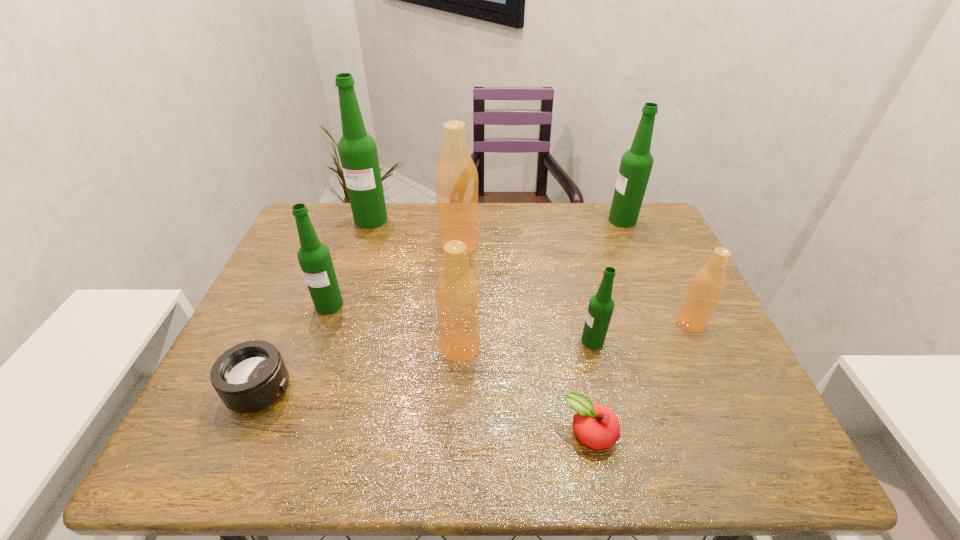
Locate an element on the screen. Image resolution: width=960 pixels, height=540 pixels. the biggest green beer bottle is located at coordinates coord(357,150).

Locate an element on the screen. The image size is (960, 540). the tallest object is located at coordinates (357, 150).

This screenshot has height=540, width=960. What are the coordinates of `the rightmost green beer bottle` in the screenshot? It's located at (636, 164).

Where is `the farthest tan beer bottle`? Image resolution: width=960 pixels, height=540 pixels. the farthest tan beer bottle is located at coordinates (456, 178).

At what (x,y) coordinates should I click in order to perform the action: click on the third farthest object. Please return your answer as a coordinate pair (x, y). The height and width of the screenshot is (540, 960). Looking at the image, I should click on (456, 178).

Locate an element on the screen. This screenshot has height=540, width=960. the second smallest green beer bottle is located at coordinates (314, 257).

At what (x,y) coordinates should I click in order to perform the action: click on the second biggest tan beer bottle. Please return your answer as a coordinate pair (x, y). Looking at the image, I should click on (457, 293).

The width and height of the screenshot is (960, 540). Identify the location of the second green beer bottle from right to left. (600, 309).

The height and width of the screenshot is (540, 960). Identify the location of the smallest green beer bottle. (600, 309).

The height and width of the screenshot is (540, 960). Identify the location of the smallest tan beer bottle. 709,282.